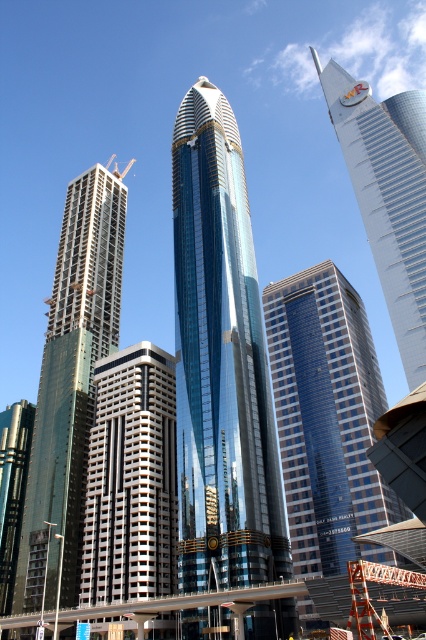
At what (x,y) coordinates should I click in order to perform the action: click on glossy glass skyscraper at center. Please return your answer as a coordinate pair (x, y). The width and height of the screenshot is (426, 640). Looking at the image, I should click on (221, 362).

Who is shorter, glossy glass skyscraper at center or gray concrete building at center?

gray concrete building at center

This screenshot has width=426, height=640. I want to click on glossy glass skyscraper at center, so click(221, 362).

Locate an element on the screen. glossy glass skyscraper at center is located at coordinates (221, 362).

Can you confirm if blue glass building at center is positioned to the left of yellow metallic crane at upper left?

No, blue glass building at center is not to the left of yellow metallic crane at upper left.

Does blue glass building at center have a greater height compared to yellow metallic crane at upper left?

Correct, blue glass building at center is much taller as yellow metallic crane at upper left.

Who is more forward, [351,484] or [117,164]?

Point [351,484] is more forward.

Locate an element on the screen. The width and height of the screenshot is (426, 640). blue glass building at center is located at coordinates (327, 419).

Which of these two, blue glass building at center or gray concrete building at center, stands shorter?

gray concrete building at center

Is blue glass building at center smaller than gray concrete building at center?

No.

Identify the location of blue glass building at center. (327, 419).